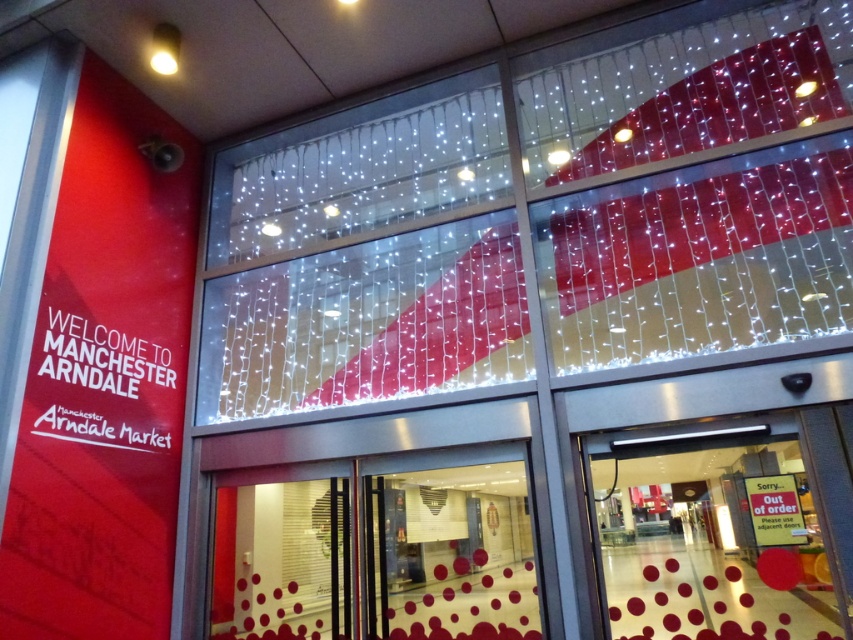
Consider the image. Who is higher up, metallic glass door at center or red plastic sign at lower right?

red plastic sign at lower right is above.

Can you confirm if metallic glass door at center is thinner than red plastic sign at lower right?

No.

Is point (399, 492) farther from camera compared to point (786, 544)?

Yes, it is.

The image size is (853, 640). Find the location of `metallic glass door at center`. metallic glass door at center is located at coordinates (379, 552).

Can you confirm if white string lights at upper center is positioned above transparent glass door at lower right?

Yes, white string lights at upper center is above transparent glass door at lower right.

Find the location of a particular element. This screenshot has width=853, height=640. white string lights at upper center is located at coordinates (543, 218).

Where is `white string lights at upper center`? This screenshot has width=853, height=640. white string lights at upper center is located at coordinates (543, 218).

Between transparent glass door at lower right and red plastic sign at lower right, which one appears on the left side from the viewer's perspective?

transparent glass door at lower right

Looking at this image, who is taller, transparent glass door at lower right or red plastic sign at lower right?

With more height is transparent glass door at lower right.

Identify the location of transparent glass door at lower right. This screenshot has height=640, width=853. (727, 536).